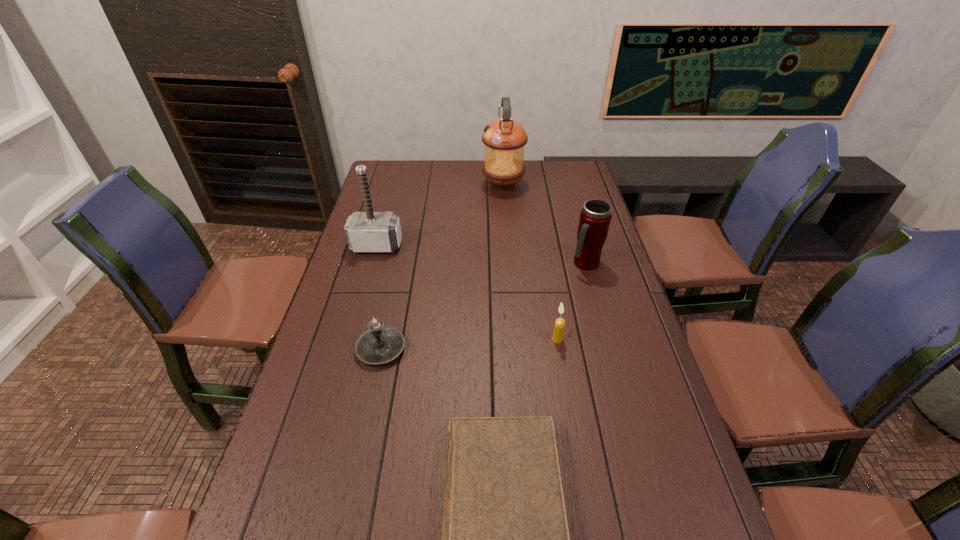
Find the location of a particular element. The image size is (960, 540). vacant point located on the back of the fifth object from left to right is located at coordinates [x=547, y=281].

The height and width of the screenshot is (540, 960). Find the location of `free spot located 0.210m on the right of the left candle`. free spot located 0.210m on the right of the left candle is located at coordinates (485, 349).

Identify the location of object at the far edge. This screenshot has width=960, height=540. (504, 139).

Where is `hammer that is at the left edge`? This screenshot has height=540, width=960. hammer that is at the left edge is located at coordinates (369, 231).

Locate an element on the screen. The height and width of the screenshot is (540, 960). candle at the left edge is located at coordinates (380, 344).

This screenshot has height=540, width=960. In order to click on object located in the right edge section of the desktop in this screenshot , I will do `click(595, 217)`.

Locate an element on the screen. The height and width of the screenshot is (540, 960). vacant space at the far edge of the desktop is located at coordinates (537, 188).

This screenshot has width=960, height=540. In the image, there is a desktop. In order to click on vacant space at the left edge in this screenshot , I will do `click(280, 449)`.

In the image, there is a desktop. Where is `free space at the right edge`? Image resolution: width=960 pixels, height=540 pixels. free space at the right edge is located at coordinates (596, 271).

Locate an element on the screen. This screenshot has width=960, height=540. free space between the right candle and the oil lamp is located at coordinates (530, 262).